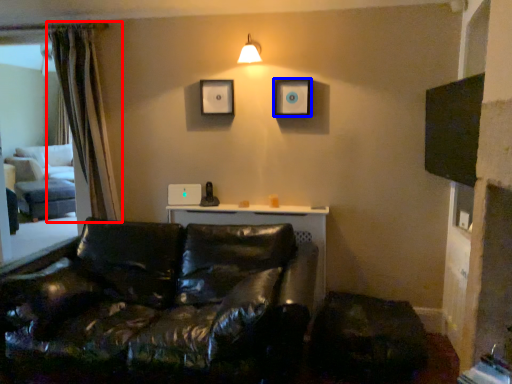
Question: Which point is closer to the camera, curtain (highlighted by a red box) or picture frame (highlighted by a blue box)?

Choices:
 (A) curtain
 (B) picture frame

Answer: (A)